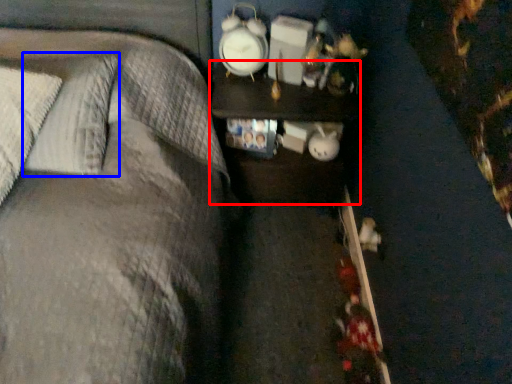
Question: Which of the following is the farthest to the observer, nightstand (highlighted by a red box) or pillow (highlighted by a blue box)?

Choices:
 (A) nightstand
 (B) pillow

Answer: (A)